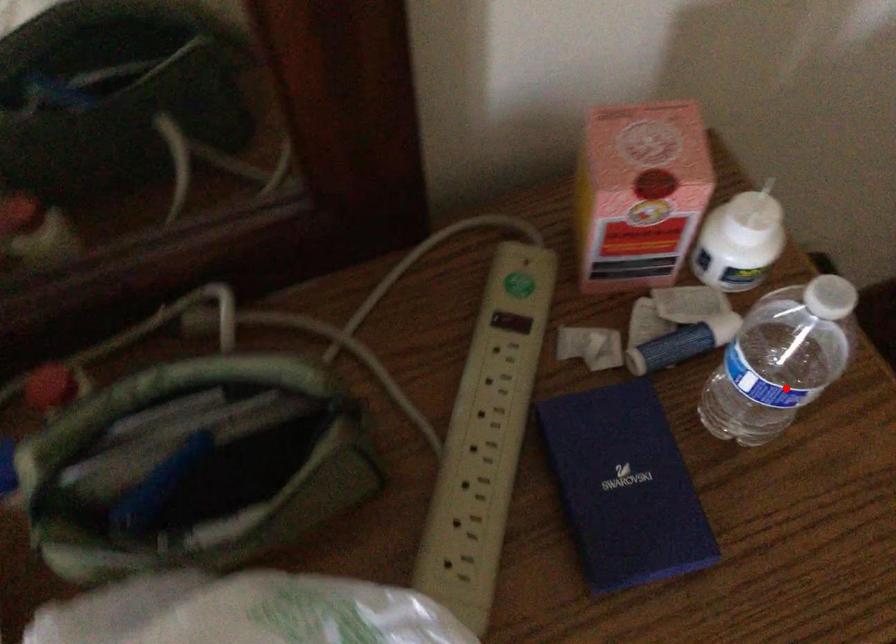
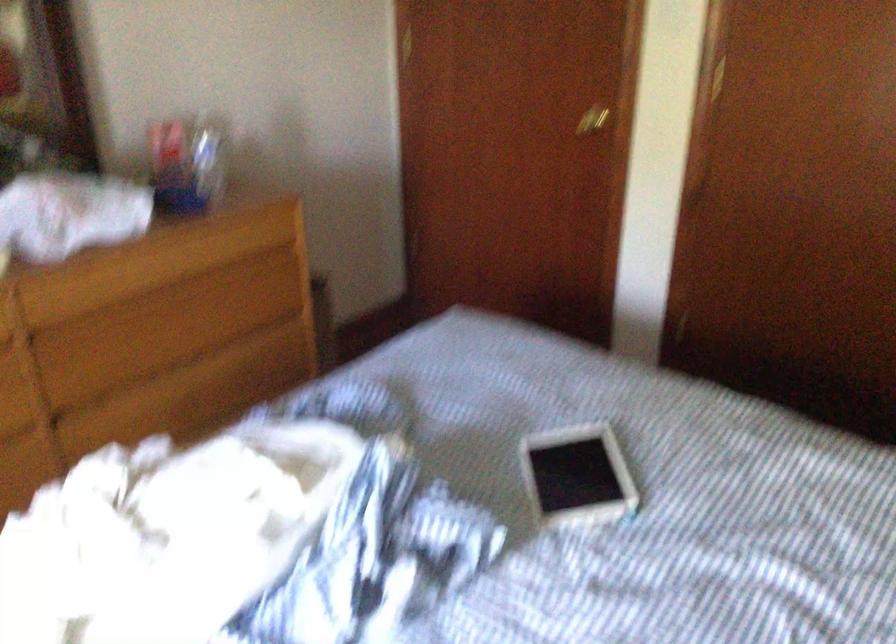
Where in the second image is the point corresponding to the highlighted location from the first image?

(208, 156)